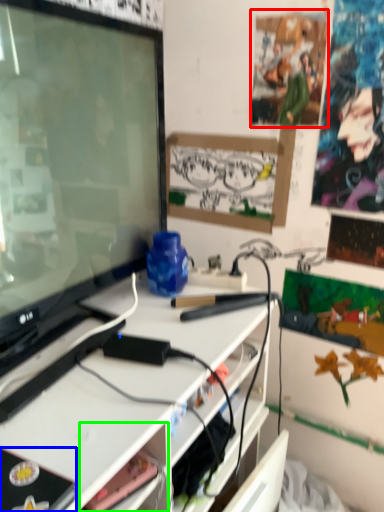
Question: Estimate the real-world distances between objects in this image. Which object is closer to poster (highlighted by a red box), equipment (highlighted by a blue box) or shelf (highlighted by a green box)?

Choices:
 (A) equipment
 (B) shelf

Answer: (B)